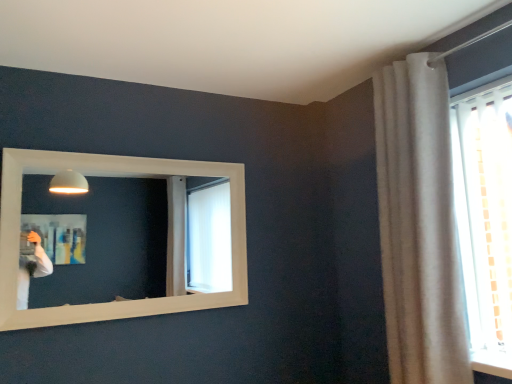
Question: Are white textured curtain at upper right and white wooden mirror at upper left beside each other?

Choices:
 (A) no
 (B) yes

Answer: (A)

Question: Considering the relative sizes of white textured curtain at upper right and white wooden mirror at upper left in the image provided, is white textured curtain at upper right thinner than white wooden mirror at upper left?

Choices:
 (A) no
 (B) yes

Answer: (A)

Question: Is white textured curtain at upper right at the right side of white wooden mirror at upper left?

Choices:
 (A) yes
 (B) no

Answer: (A)

Question: Does white textured curtain at upper right have a smaller size compared to white wooden mirror at upper left?

Choices:
 (A) no
 (B) yes

Answer: (A)

Question: Does white textured curtain at upper right lie behind white wooden mirror at upper left?

Choices:
 (A) yes
 (B) no

Answer: (B)

Question: Considering the relative sizes of white textured curtain at upper right and white wooden mirror at upper left in the image provided, is white textured curtain at upper right taller than white wooden mirror at upper left?

Choices:
 (A) no
 (B) yes

Answer: (B)

Question: From the image's perspective, would you say white wooden mirror at upper left is shown under white textured curtain at upper right?

Choices:
 (A) no
 (B) yes

Answer: (B)

Question: Is white wooden mirror at upper left oriented away from white textured curtain at upper right?

Choices:
 (A) no
 (B) yes

Answer: (A)

Question: Considering the relative sizes of white wooden mirror at upper left and white textured curtain at upper right in the image provided, is white wooden mirror at upper left smaller than white textured curtain at upper right?

Choices:
 (A) yes
 (B) no

Answer: (A)

Question: Considering the relative sizes of white wooden mirror at upper left and white textured curtain at upper right in the image provided, is white wooden mirror at upper left taller than white textured curtain at upper right?

Choices:
 (A) no
 (B) yes

Answer: (A)

Question: Is the position of white wooden mirror at upper left more distant than that of white textured curtain at upper right?

Choices:
 (A) no
 (B) yes

Answer: (B)

Question: Is white wooden mirror at upper left wider than white textured curtain at upper right?

Choices:
 (A) no
 (B) yes

Answer: (A)

Question: Is white wooden mirror at upper left wider or thinner than white textured curtain at upper right?

Choices:
 (A) wide
 (B) thin

Answer: (B)